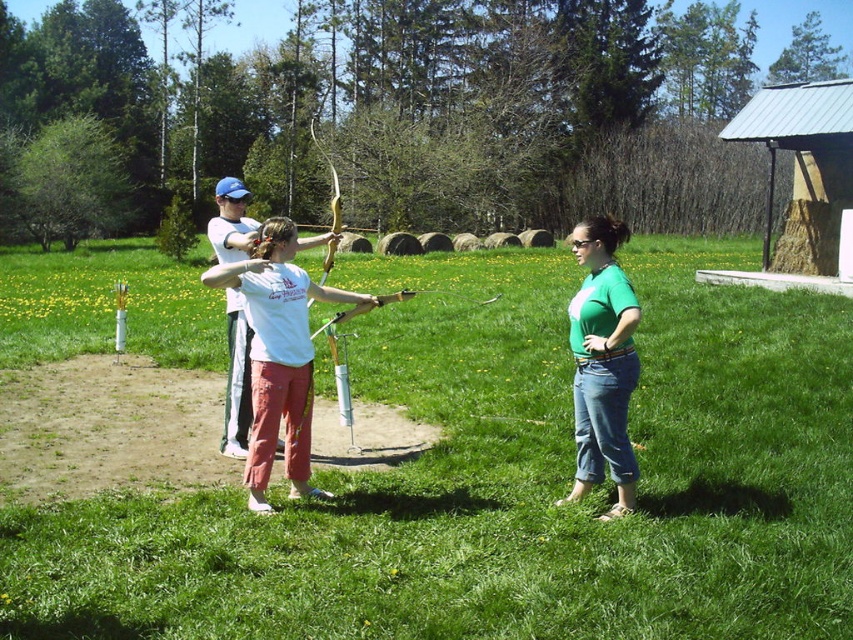
You are standing in the archery field and see the green grass at center and the white matte shirt at center. Which object is positioned to the left?

The green grass at center is to the left of the white matte shirt at center, so the green grass at center is positioned to the left.

You are an archer in the scene and you want to check the distance between the white matte shirt at center and the green matte shirt at center. Which direction should you look to see both shirts?

You should look to the left to see the white matte shirt at center and to the right to see the green matte shirt at center because the white matte shirt at center is to the left of the green matte shirt at center.